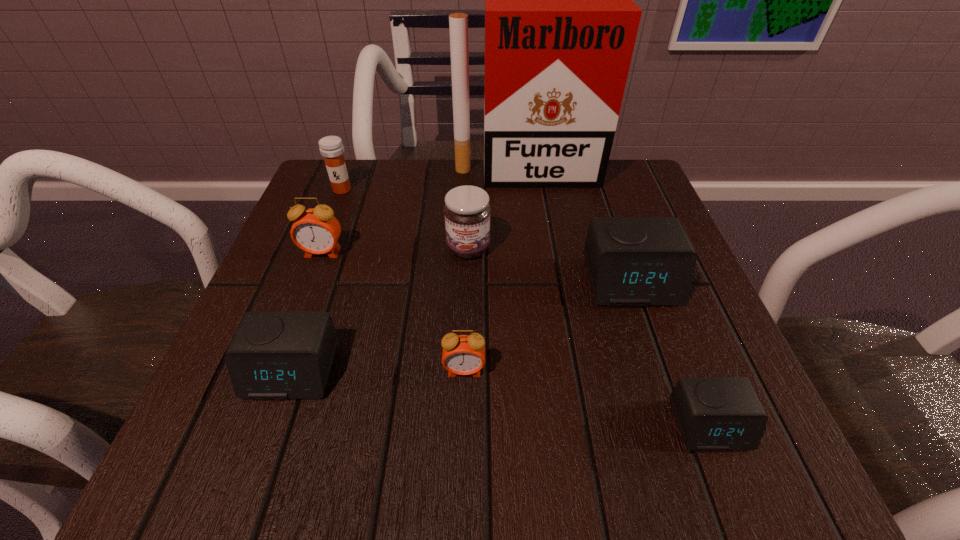
Where is `free space at the right edge of the desktop`? free space at the right edge of the desktop is located at coordinates (660, 338).

You are a GUI agent. You are given a task and a screenshot of the screen. Output one action in this format:
    pyautogui.click(x=<x>, y=<y>)
    Task: Click on the vacant space at the near left corner of the desktop
    Image resolution: width=960 pixels, height=540 pixels.
    Given the screenshot: What is the action you would take?
    pyautogui.click(x=268, y=474)

The width and height of the screenshot is (960, 540). In order to click on vacant position at the far right corner of the desktop in this screenshot , I will do `click(591, 217)`.

Where is `vacant area at the near right corner`? The width and height of the screenshot is (960, 540). vacant area at the near right corner is located at coordinates click(764, 447).

Locate an element on the screen. vacant area that lies between the shortest object and the nearer pink alarm clock is located at coordinates (588, 397).

The image size is (960, 540). I want to click on free space that is in between the bigger pink alarm clock and the shortest alarm clock, so click(516, 339).

At what (x,y) coordinates should I click in order to perform the action: click on vacant area that lies between the right pink alarm clock and the second smallest black alarm clock. Please return your answer as a coordinate pair (x, y). The width and height of the screenshot is (960, 540). Looking at the image, I should click on (378, 370).

The image size is (960, 540). I want to click on vacant space that is in between the right pink alarm clock and the medicine, so [403, 280].

You are a GUI agent. You are given a task and a screenshot of the screen. Output one action in this format:
    pyautogui.click(x=<x>, y=<y>)
    Task: Click on the free space between the biggest black alarm clock and the smaller pink alarm clock
    The image size is (960, 540).
    Given the screenshot: What is the action you would take?
    pyautogui.click(x=548, y=326)

Image resolution: width=960 pixels, height=540 pixels. I want to click on vacant area that lies between the third alarm clock from right to left and the bigger pink alarm clock, so click(394, 311).